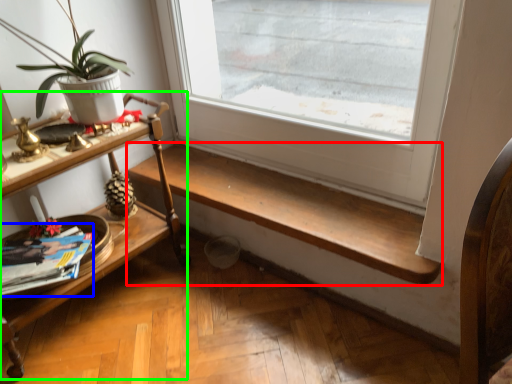
Question: Which object is positioned farthest from stairwell (highlighted by a red box)? Select from magazine (highlighted by a blue box) and shelf (highlighted by a green box).

Choices:
 (A) magazine
 (B) shelf

Answer: (A)